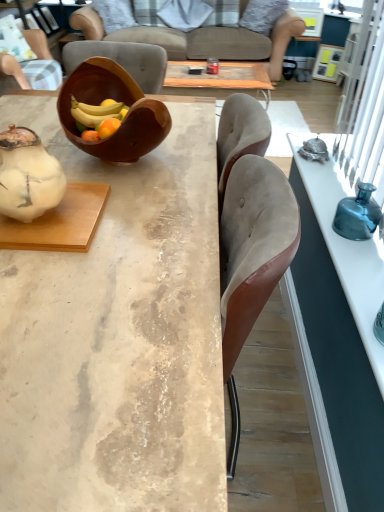
You are a GUI agent. You are given a task and a screenshot of the screen. Output one action in this format:
    pyautogui.click(x=<x>, y=<y>)
    Task: Click on the vacant space in brown wooden bowl at center (from a real-world perspective)
    This screenshot has height=512, width=384.
    Given the screenshot: What is the action you would take?
    pyautogui.click(x=135, y=160)